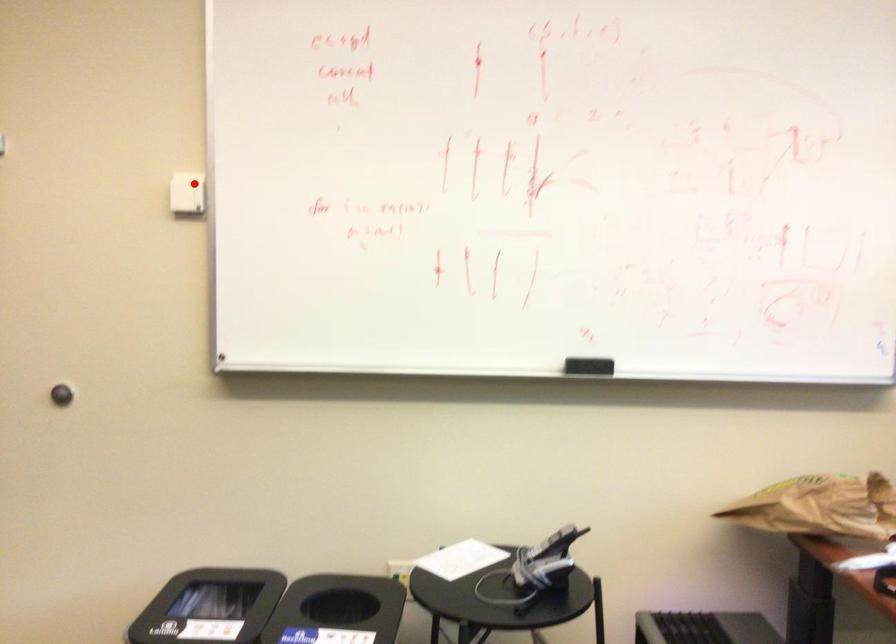
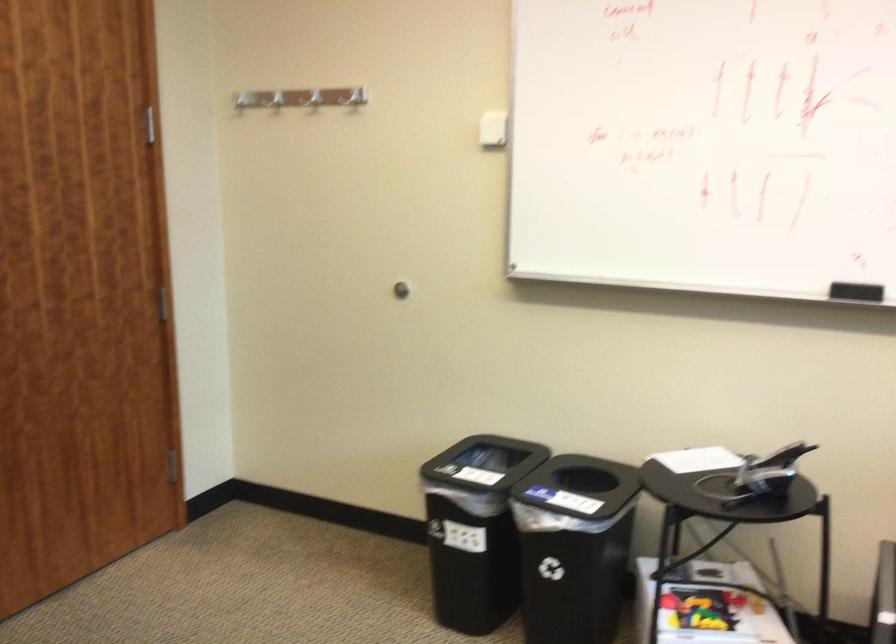
Question: A red point is marked in image1. In image2, is the corresponding 3D point closer to the camera or farther? Reply with the corresponding letter.

Choices:
 (A) The corresponding 3D point is closer.
 (B) The corresponding 3D point is farther.

Answer: (B)